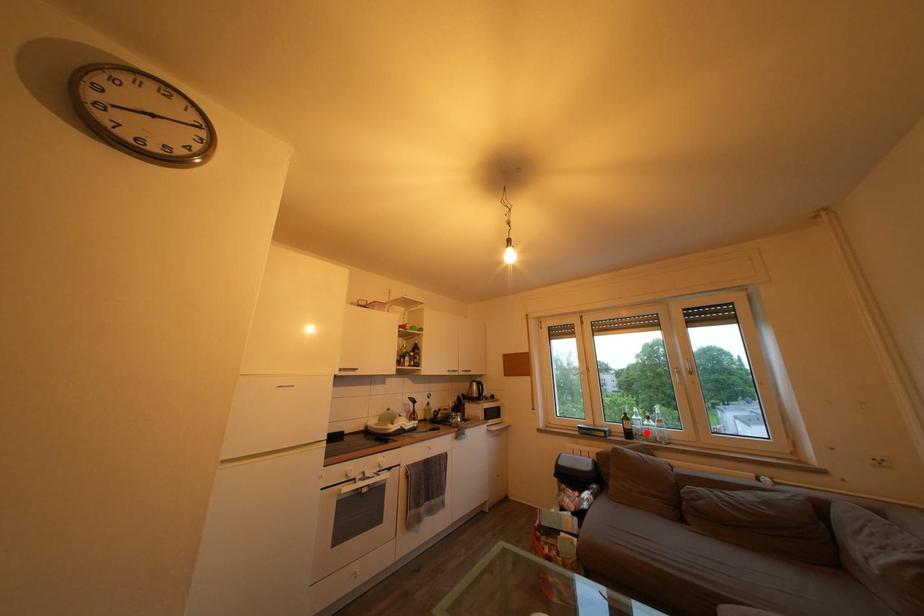
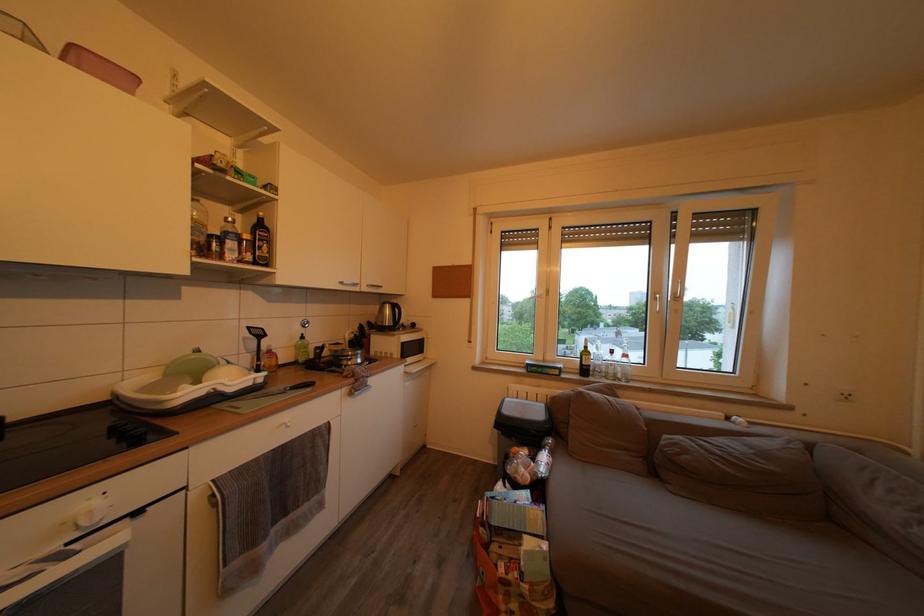
In the second image, find the point that corresponds to the highlighted location in the first image.

(608, 369)